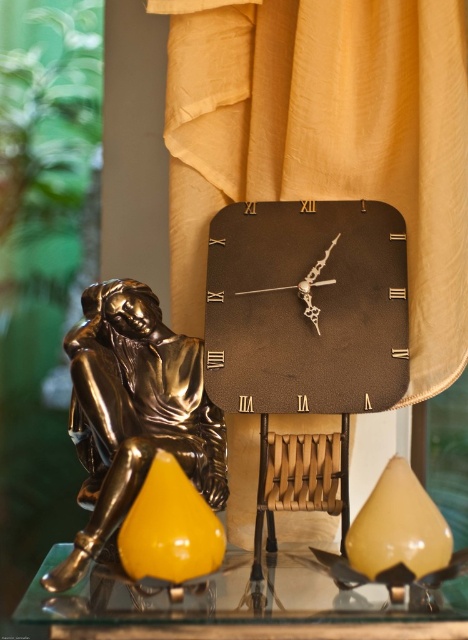
Question: Does shiny bronze statue at left have a greater width compared to transparent glass table at center?

Choices:
 (A) yes
 (B) no

Answer: (B)

Question: Which of the following is the farthest from the observer?

Choices:
 (A) shiny bronze statue at left
 (B) transparent glass table at center
 (C) black leather clock at center

Answer: (C)

Question: Which object appears closest to the camera in this image?

Choices:
 (A) black leather clock at center
 (B) shiny bronze statue at left
 (C) transparent glass table at center

Answer: (C)

Question: Where is black leather clock at center located in relation to shiny bronze statue at left in the image?

Choices:
 (A) above
 (B) below

Answer: (A)

Question: Which point is closer to the camera?

Choices:
 (A) shiny bronze statue at left
 (B) black leather clock at center
 (C) transparent glass table at center

Answer: (C)

Question: Can you confirm if shiny bronze statue at left is positioned to the left of transparent glass table at center?

Choices:
 (A) no
 (B) yes

Answer: (B)